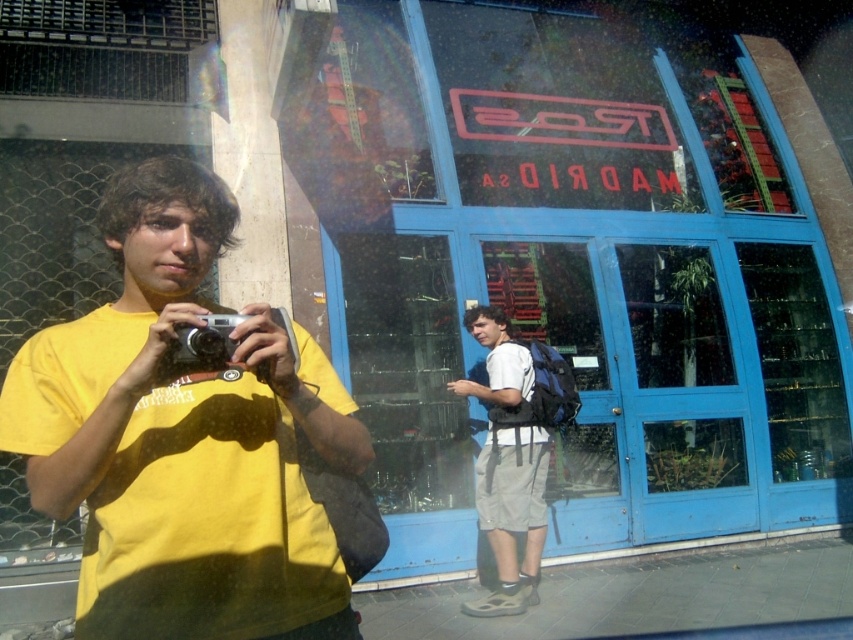
Between point (103, 307) and point (189, 340), which one is positioned in front?

Positioned in front is point (189, 340).

The width and height of the screenshot is (853, 640). What do you see at coordinates (183, 440) in the screenshot? I see `yellow matte t-shirt at left` at bounding box center [183, 440].

The image size is (853, 640). Find the location of `yellow matte t-shirt at left`. yellow matte t-shirt at left is located at coordinates (183, 440).

I want to click on yellow matte t-shirt at left, so click(x=183, y=440).

Which is below, yellow matte t-shirt at left or white matte backpack at center?

white matte backpack at center is lower down.

Can you confirm if yellow matte t-shirt at left is wider than white matte backpack at center?

Indeed, yellow matte t-shirt at left has a greater width compared to white matte backpack at center.

Identify the location of yellow matte t-shirt at left. (183, 440).

What are the coordinates of `yellow matte t-shirt at left` in the screenshot? It's located at (183, 440).

Between white matte backpack at center and silver metallic camera at center, which one appears on the right side from the viewer's perspective?

white matte backpack at center

Measure the distance between white matte backpack at center and camera.

white matte backpack at center and camera are 13.22 feet apart from each other.

Is point (509, 333) farther from camera compared to point (173, 346)?

Yes.

You are a GUI agent. You are given a task and a screenshot of the screen. Output one action in this format:
    pyautogui.click(x=<x>, y=<y>)
    Task: Click on the white matte backpack at center
    This screenshot has width=853, height=640.
    Given the screenshot: What is the action you would take?
    pyautogui.click(x=511, y=513)